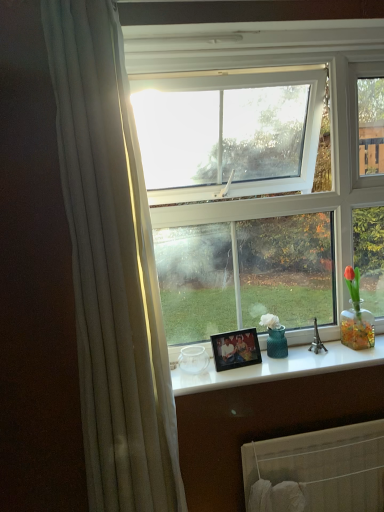
I want to click on free spot in front of wooden photo frame at center, so click(238, 375).